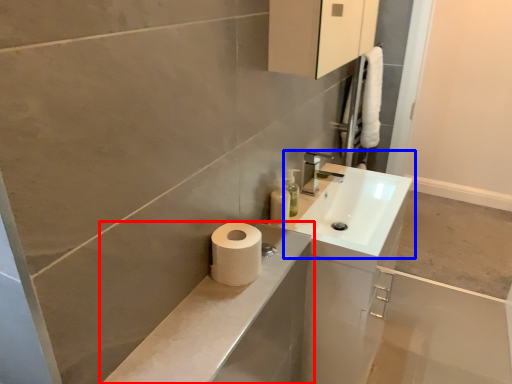
Question: Which object appears farthest to the camera in this image, bathroom cabinet (highlighted by a red box) or sink (highlighted by a blue box)?

Choices:
 (A) bathroom cabinet
 (B) sink

Answer: (B)